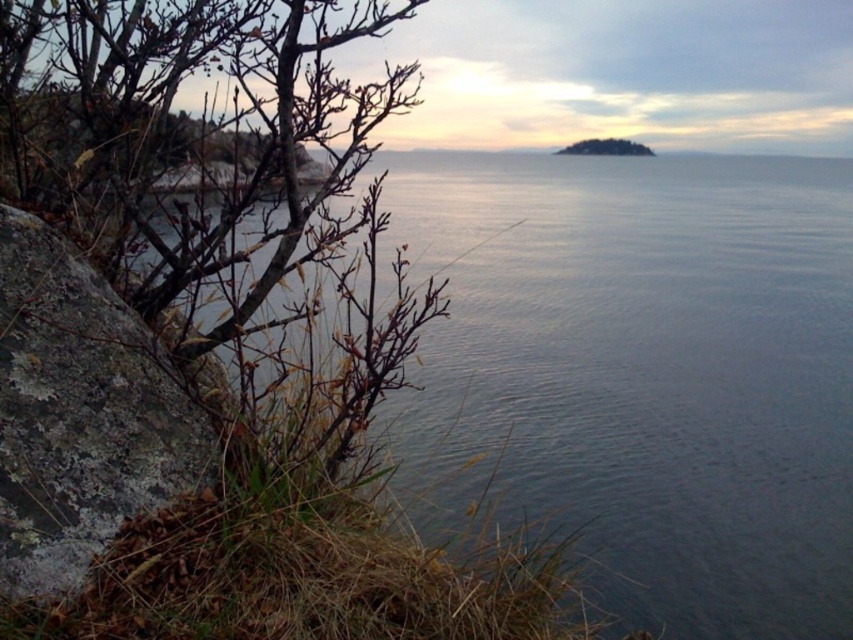
Based on the photo, you are a photographer standing on the rocky outcrop in the foreground. You want to capture a photo that includes both the smooth blue water at center and the green leafy island at center. Which object will appear larger in the photo?

The smooth blue water at center will appear larger in the photo because it has a greater height compared to the green leafy island at center.

You are standing at the edge of the rocky outcrop in the coastal scene. You notice two points marked in the image. Which point is closer to you, point (492, 228) or point (120, 392)?

Point (492, 228) is closer to you because it is further to the viewer than point (120, 392).